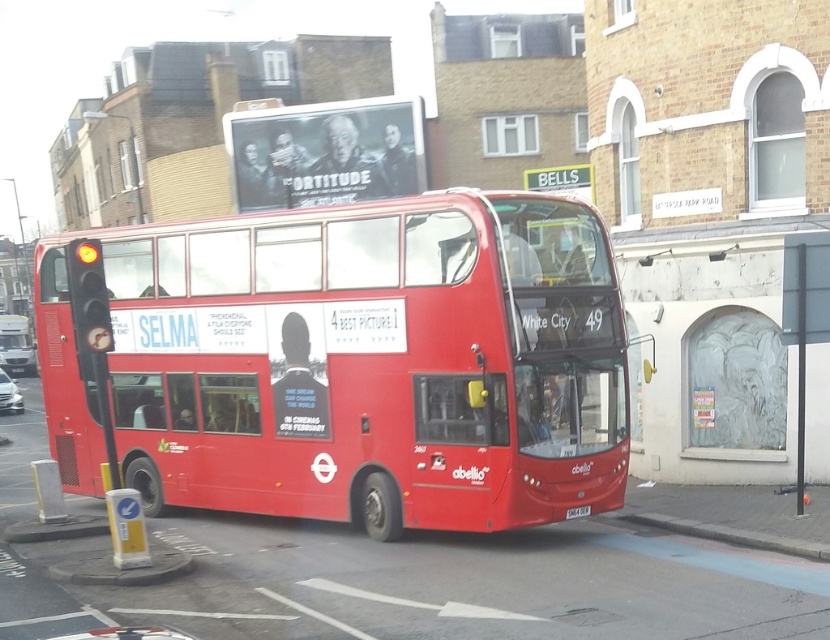
From the picture: Who is lower down, yellow glass traffic light at left or matte red bus at center?

Positioned lower is yellow glass traffic light at left.

Does yellow glass traffic light at left have a smaller size compared to matte red bus at center?

Indeed, yellow glass traffic light at left has a smaller size compared to matte red bus at center.

At what (x,y) coordinates should I click in order to perform the action: click on yellow glass traffic light at left. Please return your answer as a coordinate pair (x, y). Looking at the image, I should click on (89, 307).

Find the location of `yellow glass traffic light at left`. yellow glass traffic light at left is located at coordinates (89, 307).

Does point (3, 336) come in front of point (583, 506)?

No, (3, 336) is behind (583, 506).

Does matte red bus at center appear under white plastic license plate at center?

Actually, matte red bus at center is above white plastic license plate at center.

Between point (22, 336) and point (569, 513), which one is positioned in front?

Positioned in front is point (569, 513).

At what (x,y) coordinates should I click in order to perform the action: click on matte red bus at center. Please return your answer as a coordinate pair (x, y). Looking at the image, I should click on (16, 344).

Consider the image. Is metallic pole at center to the right of matte red bus at center from the viewer's perspective?

Indeed, metallic pole at center is positioned on the right side of matte red bus at center.

Is point (813, 323) farther from viewer compared to point (27, 330)?

That is False.

Is point (785, 310) more distant than point (13, 326)?

No.

Image resolution: width=830 pixels, height=640 pixels. What are the coordinates of `metallic pole at center` in the screenshot? It's located at (804, 317).